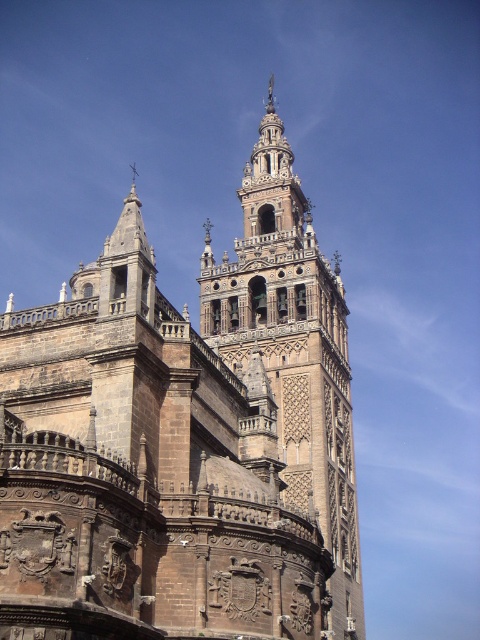
You are standing in front of the grand historic building and want to take a photo of both the brown stone church at center and the brown stone tower at center. Which one should you position to your left to include both in the frame?

You should position the brown stone tower at center to your left because the brown stone church at center is to the left of the brown stone tower at center, so arranging them with the tower on your left will ensure both are in the frame.

You are an architect visiting the historic site and need to determine which structure occupies more space in the image for your design plans. Based on the scene, which one is bigger between the brown stone church at center and the brown stone tower at center?

The brown stone church at center has a larger size compared to the brown stone tower at center, so it occupies more space in the image.

Based on the photo, you are an architect examining the image of a historic building. You notice the brown stone church at center and the brown stone tower at center. Which structure has a greater height?

The brown stone tower at center is taller than the brown stone church at center, so the tower has a greater height.